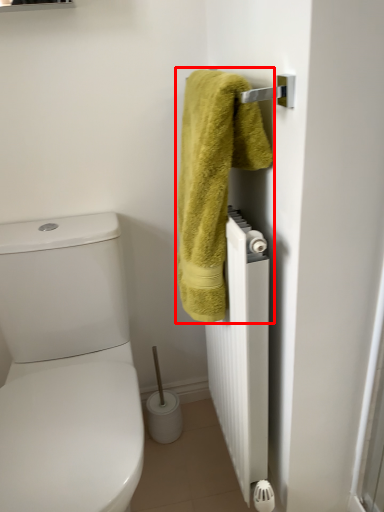
Question: Observing the image, what is the correct spatial positioning of towel (annotated by the red box) in reference to radiator?

Choices:
 (A) right
 (B) left

Answer: (B)